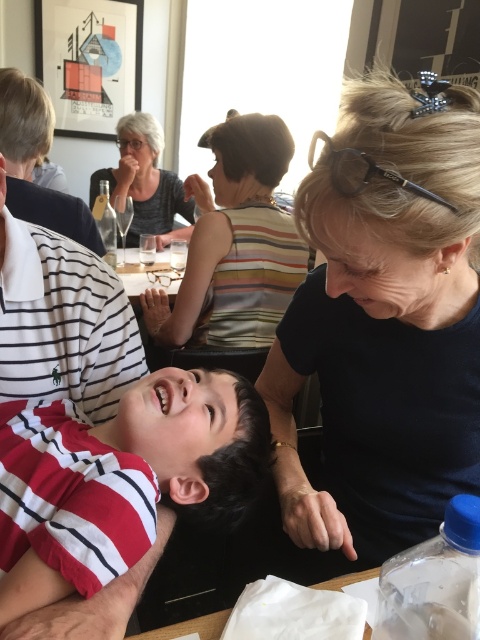
Is black matte hair at upper right to the right of red striped shirt at lower left from the viewer's perspective?

A: Correct, you'll find black matte hair at upper right to the right of red striped shirt at lower left.

Who is more forward, (432, 326) or (131, 536)?

Answer: Point (131, 536) is in front.

You are a GUI agent. You are given a task and a screenshot of the screen. Output one action in this format:
    pyautogui.click(x=<x>, y=<y>)
    Task: Click on the black matte hair at upper right
    The height and width of the screenshot is (640, 480).
    Given the screenshot: What is the action you would take?
    pyautogui.click(x=384, y=321)

Which is below, black matte hair at upper right or striped fabric shirt at upper center?

black matte hair at upper right

Is black matte hair at upper right thinner than striped fabric shirt at upper center?

Yes.

Which is behind, point (462, 164) or point (305, 272)?

Point (305, 272)

Where is `black matte hair at upper right`? black matte hair at upper right is located at coordinates (384, 321).

What are the coordinates of `striped fabric shirt at upper center` in the screenshot? It's located at (x=235, y=243).

Between striped fabric shirt at upper center and matte black jacket at upper left, which one appears on the right side from the viewer's perspective?

From the viewer's perspective, striped fabric shirt at upper center appears more on the right side.

Who is more distant from viewer, [288,250] or [4,108]?

Point [4,108]

Locate an element on the screen. The width and height of the screenshot is (480, 640). striped fabric shirt at upper center is located at coordinates (235, 243).